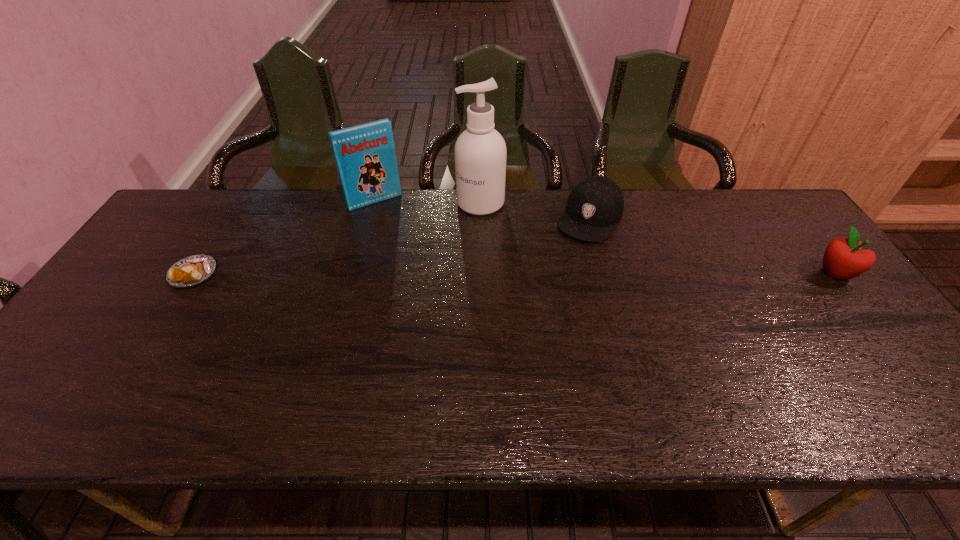
Where is `vacant area in the image that satisfies the following two spatial constraints: 1. on the front side of the fourth shortest object; 2. on the side where a bite is taken out of the apple`? vacant area in the image that satisfies the following two spatial constraints: 1. on the front side of the fourth shortest object; 2. on the side where a bite is taken out of the apple is located at coordinates (355, 273).

You are a GUI agent. You are given a task and a screenshot of the screen. Output one action in this format:
    pyautogui.click(x=<x>, y=<y>)
    Task: Click on the free space in the image that satisfies the following two spatial constraints: 1. on the front side of the tallest object; 2. on the right side of the book
    The image size is (960, 540).
    Given the screenshot: What is the action you would take?
    pyautogui.click(x=374, y=203)

The image size is (960, 540). I want to click on free location that satisfies the following two spatial constraints: 1. on the back side of the shortest object; 2. on the left side of the book, so click(x=240, y=201).